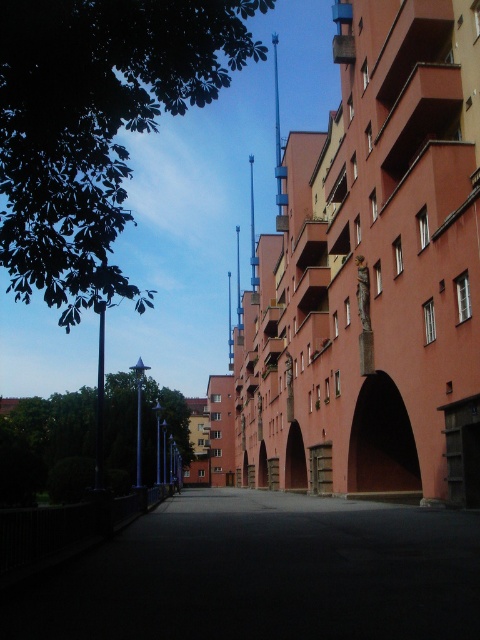
Question: Based on their relative distances, which object is nearer to the matte pink archway at center?

Choices:
 (A) green leafy tree at upper left
 (B) dark matte archway at center
 (C) dark concrete alley at center

Answer: (B)

Question: Which point is closer to the camera?

Choices:
 (A) matte pink archway at center
 (B) dark matte archway at center
 (C) green leafy tree at left
 (D) green leafy tree at upper left

Answer: (D)

Question: Does green leafy tree at left have a larger size compared to dark matte archway at center?

Choices:
 (A) yes
 (B) no

Answer: (A)

Question: Is dark concrete alley at center closer to the viewer compared to green leafy tree at left?

Choices:
 (A) yes
 (B) no

Answer: (A)

Question: Is green leafy tree at left further to camera compared to dark matte archway at center?

Choices:
 (A) no
 (B) yes

Answer: (A)

Question: Which is farther from the green leafy tree at upper left?

Choices:
 (A) dark matte archway at center
 (B) dark concrete alley at center
 (C) green leafy tree at left

Answer: (A)